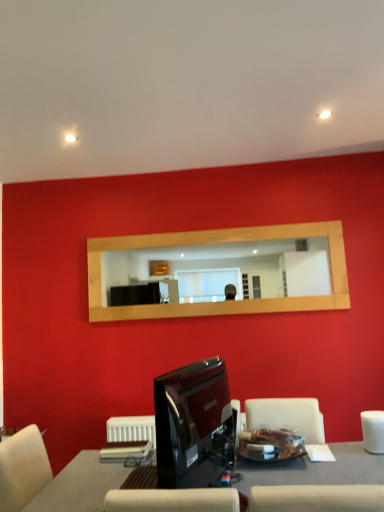
In order to click on vacant area on top of wooden mirror at center (from a real-world perspective) in this screenshot , I will do `click(208, 229)`.